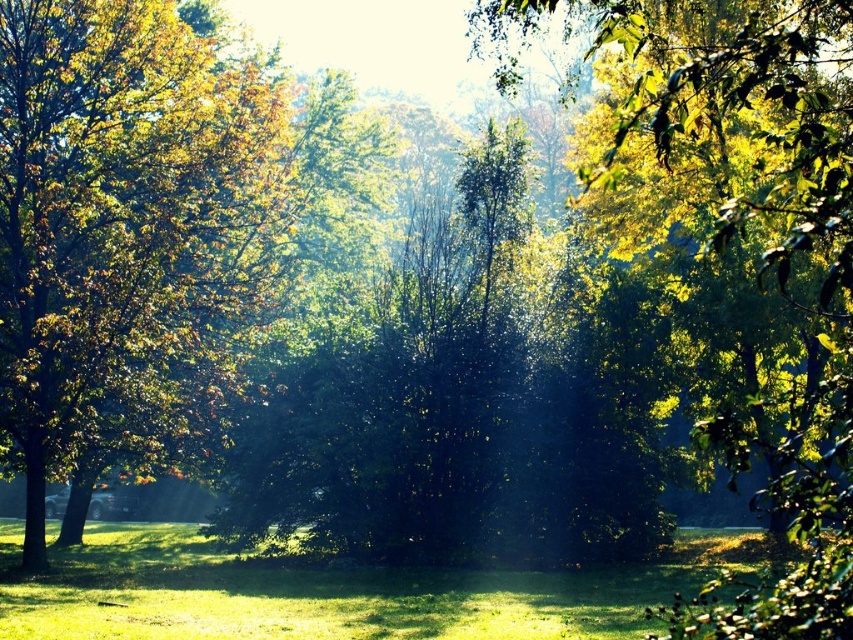
You are standing at the center of the scene. Which direction should you walk to reach the green leafy tree at left?

The green leafy tree at left is located at point coordinates of 0.361 on the x axis and 0.152 on the y axis. Since you are at the center, you should walk towards the left and slightly forward to reach it.